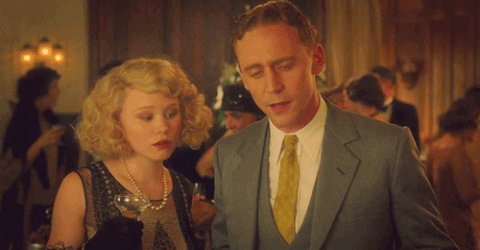
At what (x,y) coordinates should I click in order to perform the action: click on illuminated lights. Please return your answer as a coordinate pair (x, y). Looking at the image, I should click on (27, 57), (44, 49), (57, 56).